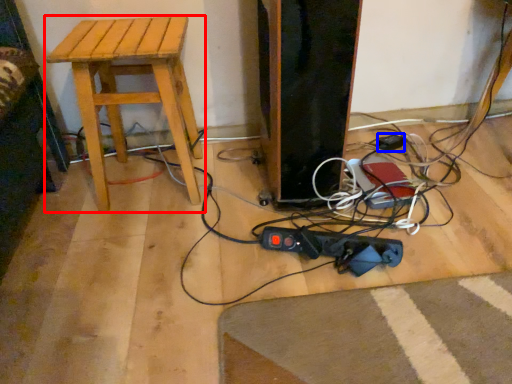
Question: Which object appears closest to the camera in this image, stool (highlighted by a red box) or plug (highlighted by a blue box)?

Choices:
 (A) stool
 (B) plug

Answer: (A)